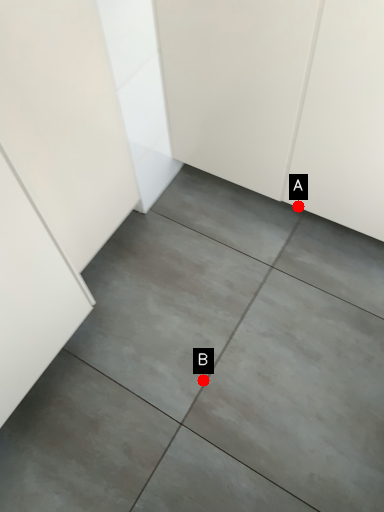
Question: Two points are circled on the image, labeled by A and B beside each circle. Which point is farther to the camera?

Choices:
 (A) A is further
 (B) B is further

Answer: (A)